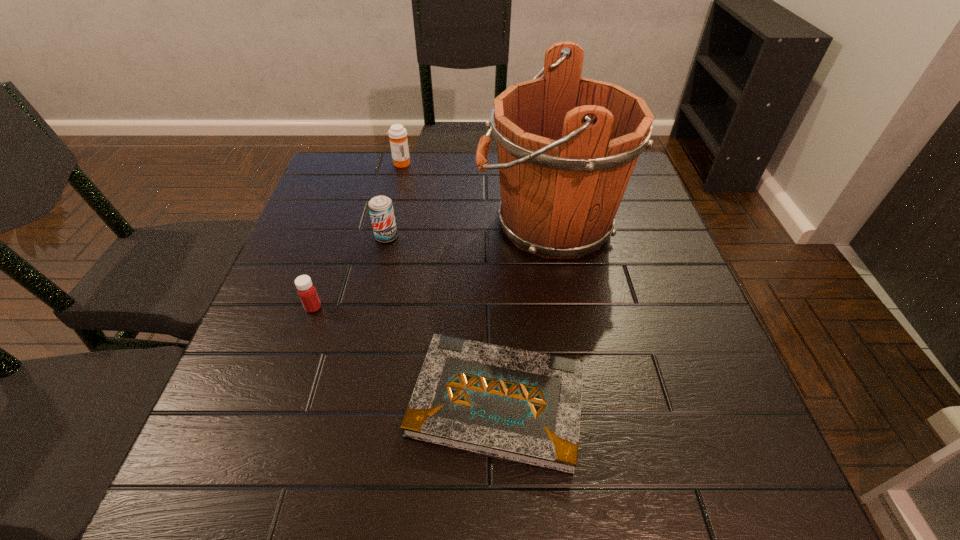
This screenshot has height=540, width=960. I want to click on vacant area that lies between the shorter medicine and the farthest object, so click(357, 235).

This screenshot has width=960, height=540. I want to click on empty space between the notebook and the beer can, so click(x=442, y=319).

Find the location of a particular element. The image size is (960, 540). vacant point located between the tallest object and the farthest object is located at coordinates (474, 193).

You are a GUI agent. You are given a task and a screenshot of the screen. Output one action in this format:
    pyautogui.click(x=<x>, y=<y>)
    Task: Click on the vacant area between the tallest object and the nearest object
    
    Given the screenshot: What is the action you would take?
    pyautogui.click(x=522, y=313)

Where is `free space between the beer can and the shorter medicine`? This screenshot has width=960, height=540. free space between the beer can and the shorter medicine is located at coordinates [350, 272].

The image size is (960, 540). I want to click on unoccupied area between the shorter medicine and the notebook, so click(x=405, y=355).

Identify the location of object that can be found as the third closest to the taller medicine. The height and width of the screenshot is (540, 960). (307, 292).

Find the location of a particular element. This screenshot has height=540, width=960. object that is the second nearest to the beer can is located at coordinates (307, 292).

Locate an element on the screen. vacant space that satisfies the following two spatial constraints: 1. on the front side of the beer can; 2. on the right side of the nearest object is located at coordinates tap(349, 402).